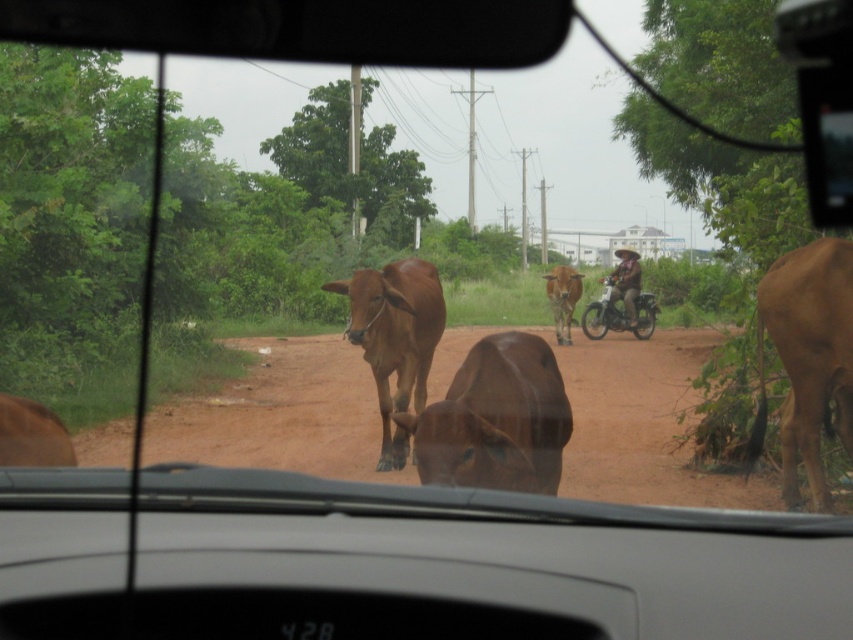
Between brown dirt track at center and metallic silver motorcycle at center, which one is positioned lower?

brown dirt track at center is lower down.

The height and width of the screenshot is (640, 853). What do you see at coordinates (281, 413) in the screenshot?
I see `brown dirt track at center` at bounding box center [281, 413].

Identify the location of brown dirt track at center. The width and height of the screenshot is (853, 640). (281, 413).

Can you confirm if brown matte bull at center is positioned below brown matte cow at center?

Incorrect, brown matte bull at center is not positioned below brown matte cow at center.

Is point (511, 406) positioned in front of point (387, 301)?

Yes, point (511, 406) is closer to viewer.

Image resolution: width=853 pixels, height=640 pixels. I want to click on brown matte bull at center, so click(495, 419).

Based on the photo, who is lower down, brown matte bull at right or brown matte cow at center?

Positioned lower is brown matte cow at center.

You are a GUI agent. You are given a task and a screenshot of the screen. Output one action in this format:
    pyautogui.click(x=<x>, y=<y>)
    Task: Click on the brown matte bull at right
    
    Given the screenshot: What is the action you would take?
    pyautogui.click(x=807, y=356)